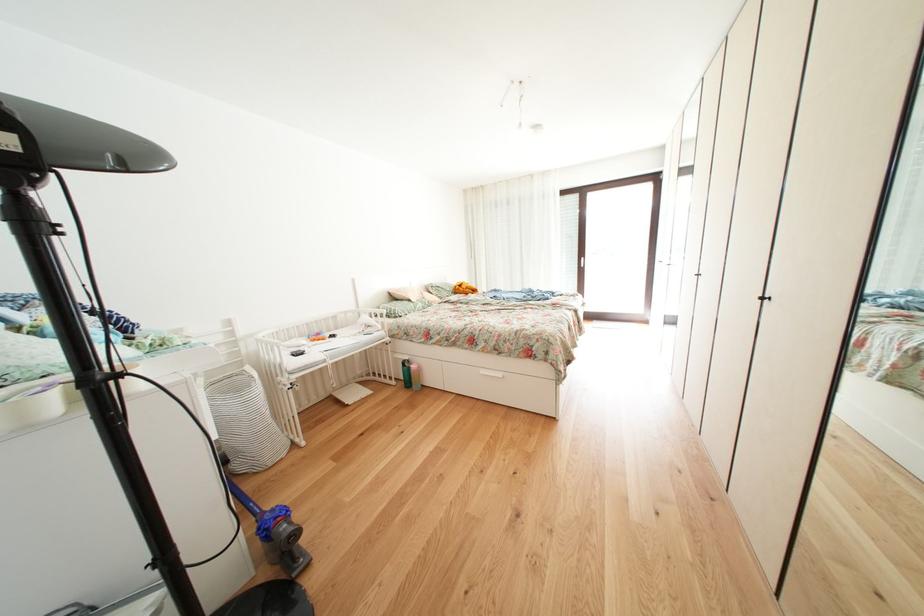
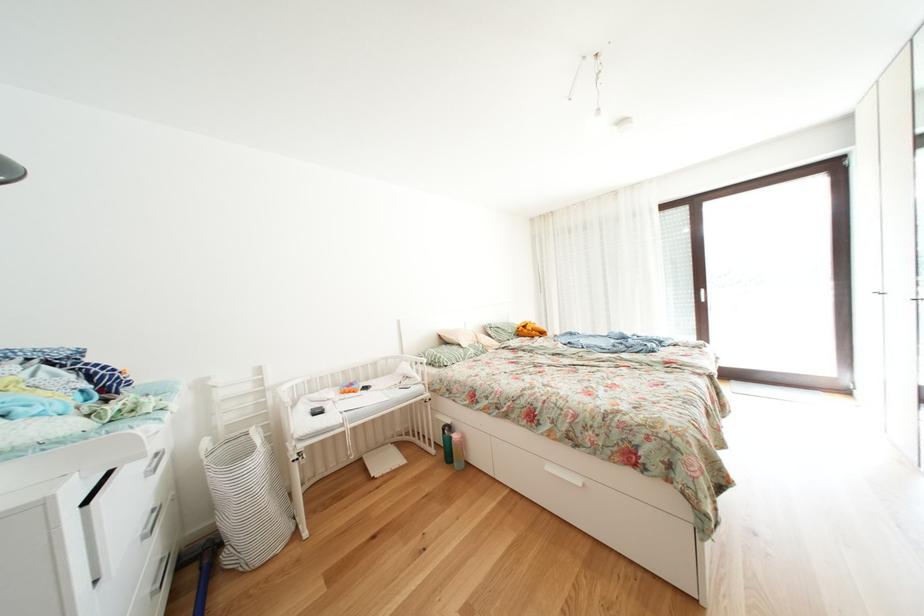
In the second image, find the point that corresponds to (x=403, y=387) in the first image.

(443, 456)